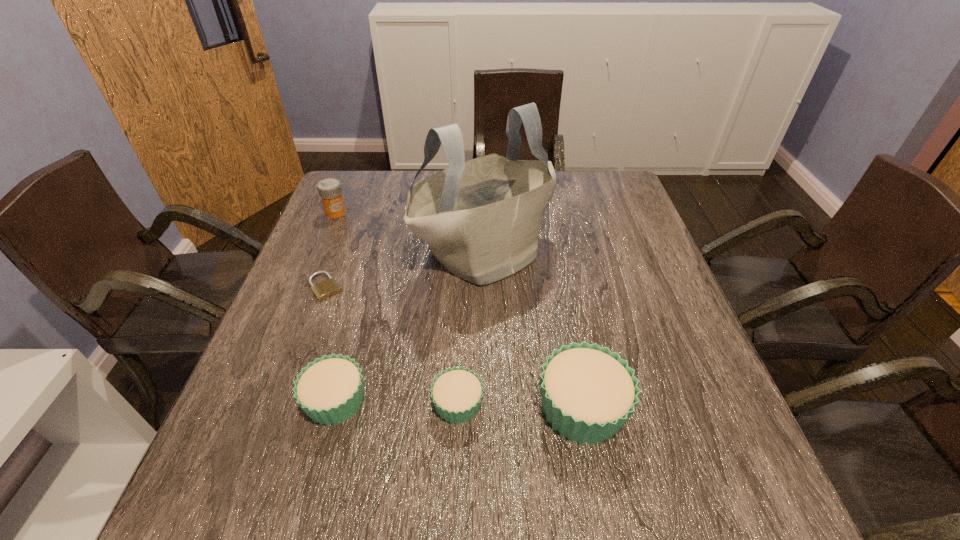
Find the location of a particular element. vacant space at the far edge of the desktop is located at coordinates (566, 201).

The width and height of the screenshot is (960, 540). In the image, there is a desktop. In order to click on vacant space at the near edge in this screenshot , I will do `click(398, 429)`.

You are a GUI agent. You are given a task and a screenshot of the screen. Output one action in this format:
    pyautogui.click(x=<x>, y=<y>)
    Task: Click on the vacant space at the left edge
    The image size is (960, 540).
    Given the screenshot: What is the action you would take?
    pyautogui.click(x=304, y=249)

Locate an element on the screen. vacant space at the right edge is located at coordinates coord(613,267).

Image resolution: width=960 pixels, height=540 pixels. Find the location of `vacant space at the far left corner of the desktop`. vacant space at the far left corner of the desktop is located at coordinates (345, 183).

Where is `vacant area at the near left corner`? vacant area at the near left corner is located at coordinates (260, 450).

The height and width of the screenshot is (540, 960). I want to click on vacant space at the far right corner of the desktop, so click(618, 209).

Identify the location of vacant point located between the rightmost cupcake and the fifth tallest object. (520, 406).

At what (x,y) coordinates should I click in order to perform the action: click on free space that is in between the shopping bag and the fourth tallest object. Please return your answer as a coordinate pair (x, y). The height and width of the screenshot is (540, 960). Looking at the image, I should click on (410, 327).

Find the location of a particular element. This screenshot has width=960, height=540. empty location between the second cupcake from right to left and the medicine is located at coordinates (396, 308).